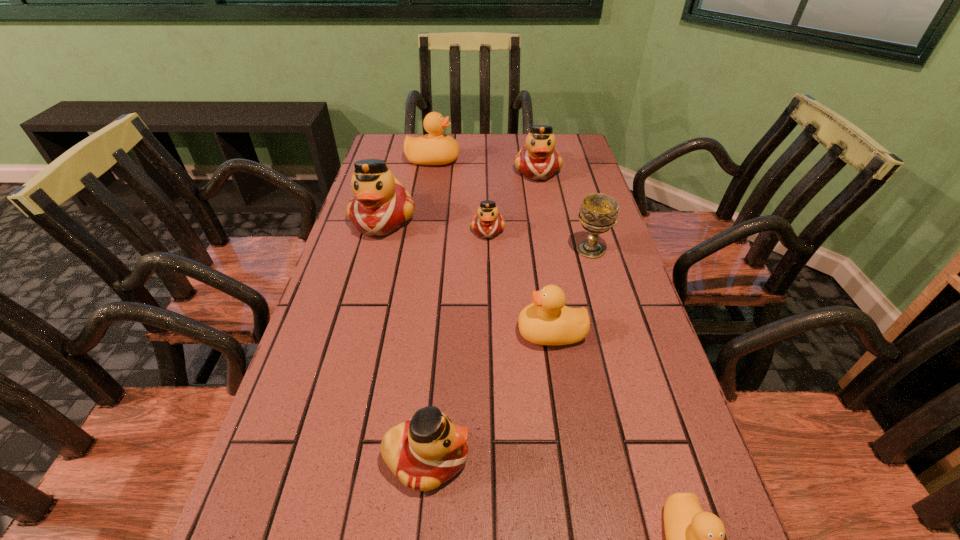
The height and width of the screenshot is (540, 960). What are the coordinates of `blank area located 0.150m on the face of the smallest red duck` in the screenshot? It's located at (489, 280).

Find the location of a particular element. Image resolution: width=960 pixels, height=540 pixels. chalice located in the right edge section of the desktop is located at coordinates (598, 213).

Locate an element on the screen. object situated at the far left corner is located at coordinates (435, 148).

This screenshot has width=960, height=540. Identify the location of object positioned at the far right corner. (538, 160).

Find the location of a particular element. This screenshot has width=960, height=540. free location at the left edge is located at coordinates (319, 512).

The image size is (960, 540). I want to click on free space at the right edge, so click(634, 529).

In the image, there is a desktop. Where is `free space at the far left corner`? This screenshot has height=540, width=960. free space at the far left corner is located at coordinates (384, 147).

Identify the location of vacant space in between the smallest red duck and the third nearest object. (519, 281).

At what (x,y) coordinates should I click in order to perform the action: click on free point between the smallest red duck and the nearest red duck. Please return your answer as a coordinate pair (x, y). Looking at the image, I should click on (457, 344).

Where is `free point between the smallest red duck and the second biggest yellow duck`? free point between the smallest red duck and the second biggest yellow duck is located at coordinates (519, 281).